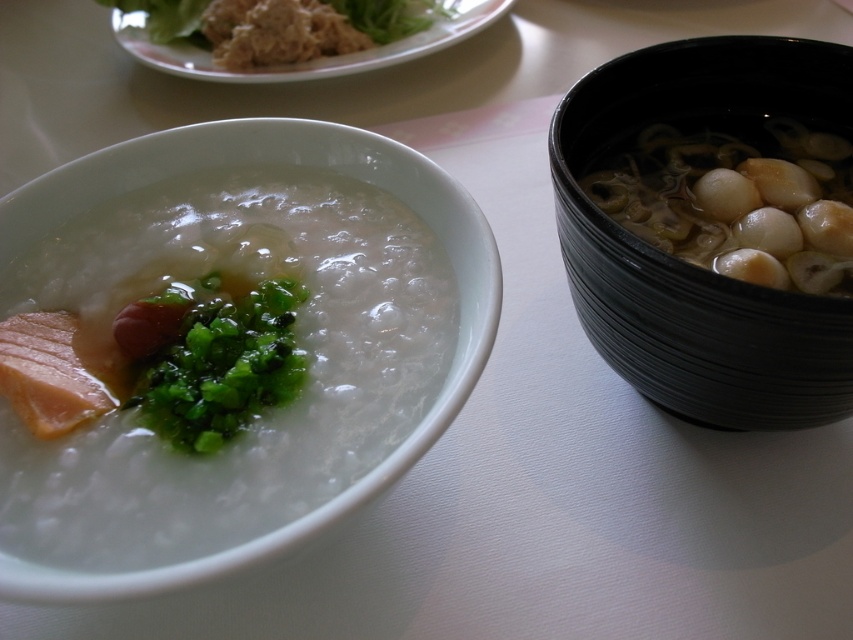
Locate an element on the screen. This screenshot has width=853, height=640. white glossy bowl at center is located at coordinates (260, 163).

Which is in front, point (216, 577) or point (184, 451)?

Point (216, 577)

Between point (254, 144) and point (148, 416), which one is positioned behind?

Point (254, 144)

Locate an element on the screen. The height and width of the screenshot is (640, 853). white glossy bowl at center is located at coordinates (260, 163).

Find the location of `black glossy bowl at right`. black glossy bowl at right is located at coordinates (689, 262).

Where is `black glossy bowl at right`? black glossy bowl at right is located at coordinates (689, 262).

Between black glossy bowl at right and white glossy bowl at center, which one has more height?

With more height is black glossy bowl at right.

Which of these two, black glossy bowl at right or white glossy bowl at center, stands shorter?

white glossy bowl at center is shorter.

Is point (724, 116) positioned after point (405, 198)?

Yes, it is.

Locate an element on the screen. Image resolution: width=853 pixels, height=640 pixels. black glossy bowl at right is located at coordinates (689, 262).